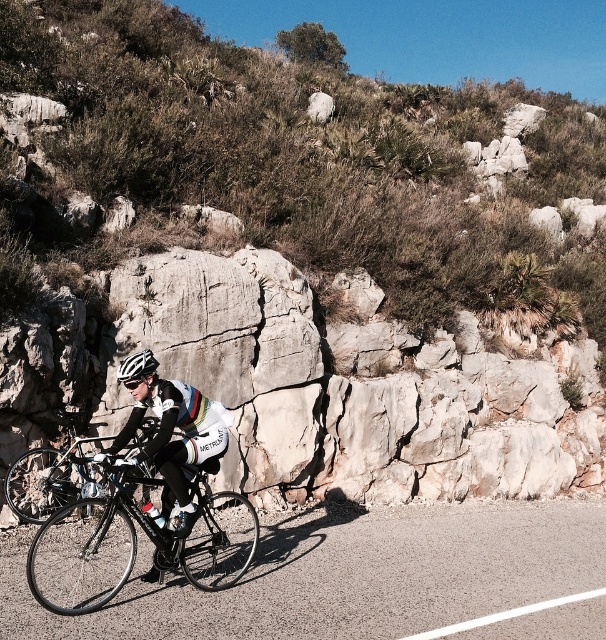
You are a photographer planning to take a photo of the cyclist. You want to ensure the black asphalt road at center and the white matte cycling jersey at center are both clearly visible. Which object should you focus on to ensure the thinner one is sharp?

The black asphalt road at center is thinner than the white matte cycling jersey at center, so you should focus on the black asphalt road at center to ensure the thinner object is sharp.

You are a drone operator trying to capture the cyclist from above. The black asphalt road at center and the white matte cycling jersey at center are both in your camera view. Which object is closer to your drone?

The black asphalt road at center is closer to the drone because it is in front of the white matte cycling jersey at center.